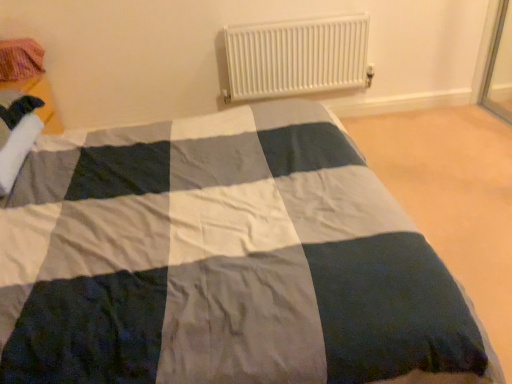
Question: From the image's perspective, is white plastic radiator at upper center above pink knitted fabric at upper left?

Choices:
 (A) no
 (B) yes

Answer: (B)

Question: Is white plastic radiator at upper center further to camera compared to pink knitted fabric at upper left?

Choices:
 (A) yes
 (B) no

Answer: (A)

Question: Considering the relative sizes of white plastic radiator at upper center and pink knitted fabric at upper left in the image provided, is white plastic radiator at upper center bigger than pink knitted fabric at upper left?

Choices:
 (A) no
 (B) yes

Answer: (B)

Question: Does white plastic radiator at upper center have a smaller size compared to pink knitted fabric at upper left?

Choices:
 (A) yes
 (B) no

Answer: (B)

Question: Considering the relative sizes of white plastic radiator at upper center and pink knitted fabric at upper left in the image provided, is white plastic radiator at upper center wider than pink knitted fabric at upper left?

Choices:
 (A) no
 (B) yes

Answer: (A)

Question: Is white plastic radiator at upper center positioned far away from pink knitted fabric at upper left?

Choices:
 (A) yes
 (B) no

Answer: (A)

Question: Would you say white plastic radiator at upper center is part of pink knitted fabric at upper left's contents?

Choices:
 (A) yes
 (B) no

Answer: (B)

Question: Is white plastic radiator at upper center at the back of pink knitted fabric at upper left?

Choices:
 (A) yes
 (B) no

Answer: (B)

Question: Does pink knitted fabric at upper left have a greater width compared to white plastic radiator at upper center?

Choices:
 (A) no
 (B) yes

Answer: (B)

Question: Is pink knitted fabric at upper left to the left of white plastic radiator at upper center from the viewer's perspective?

Choices:
 (A) yes
 (B) no

Answer: (A)

Question: From a real-world perspective, is pink knitted fabric at upper left located higher than white plastic radiator at upper center?

Choices:
 (A) yes
 (B) no

Answer: (A)

Question: Is the depth of pink knitted fabric at upper left greater than that of white plastic radiator at upper center?

Choices:
 (A) yes
 (B) no

Answer: (B)

Question: Considering the relative positions of pink knitted fabric at upper left and white plastic radiator at upper center in the image provided, is pink knitted fabric at upper left to the left or to the right of white plastic radiator at upper center?

Choices:
 (A) left
 (B) right

Answer: (A)